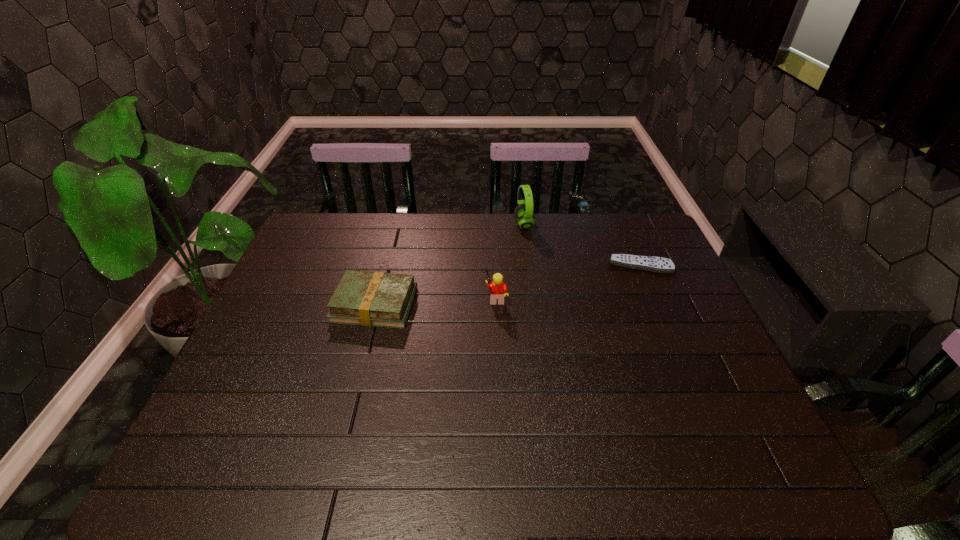
Locate an element on the screen. vacant region between the second farthest object and the farthest object is located at coordinates click(x=582, y=245).

You are a GUI agent. You are given a task and a screenshot of the screen. Output one action in this format:
    pyautogui.click(x=<x>, y=<y>)
    Task: Click on the object that is the nearest to the tallest object
    Image resolution: width=960 pixels, height=540 pixels.
    Given the screenshot: What is the action you would take?
    pyautogui.click(x=648, y=263)

Identify which object is the closest to the rightmost object. Please provide its 2D coordinates. Your answer should be formatted as a tuple, i.e. [(x, y)], where the tuple contains the x and y coordinates of a point satisfying the conditions above.

[(523, 213)]

Locate an element on the screen. The height and width of the screenshot is (540, 960). vacant space that satisfies the following two spatial constraints: 1. on the back side of the remote control; 2. on the left side of the book is located at coordinates (385, 266).

At what (x,y) coordinates should I click in order to perform the action: click on free space in the image that satisfies the following two spatial constraints: 1. on the back side of the second farthest object; 2. on the left side of the book. Please return your answer as a coordinate pair (x, y). The image size is (960, 540). Looking at the image, I should click on (385, 266).